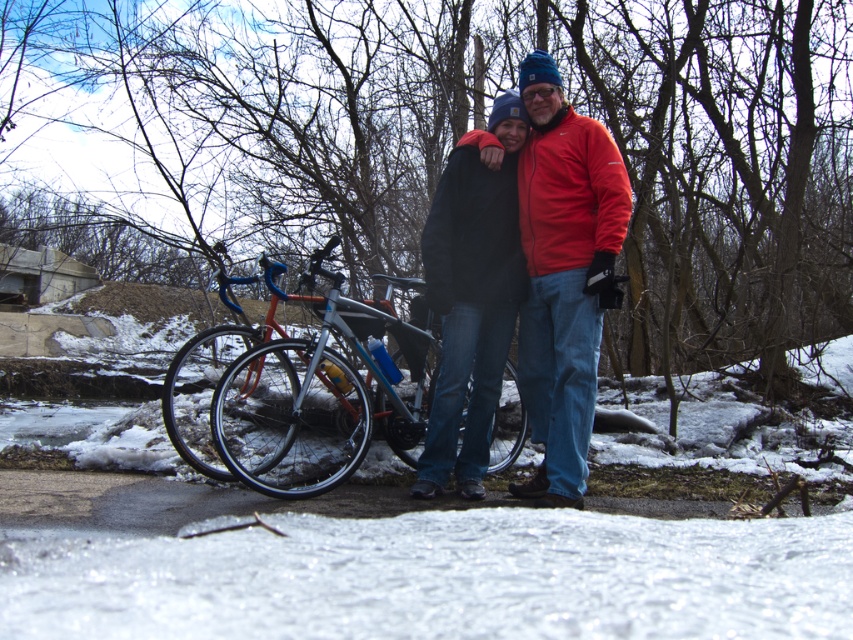
Question: Which point is farther to the camera?

Choices:
 (A) matte black jacket at center
 (B) black matte jacket at center

Answer: (B)

Question: Considering the real-world distances, which object is closest to the matte black jacket at center?

Choices:
 (A) shiny metallic bicycle at center
 (B) black matte jacket at center

Answer: (B)

Question: Observing the image, what is the correct spatial positioning of shiny metallic bicycle at center in reference to black matte jacket at center?

Choices:
 (A) below
 (B) above

Answer: (A)

Question: Can you confirm if shiny metallic bicycle at center is bigger than black matte jacket at center?

Choices:
 (A) no
 (B) yes

Answer: (B)

Question: Is matte black jacket at center to the right of black matte jacket at center from the viewer's perspective?

Choices:
 (A) no
 (B) yes

Answer: (B)

Question: Which object appears farthest from the camera in this image?

Choices:
 (A) shiny metallic bicycle at center
 (B) black matte jacket at center
 (C) matte black jacket at center

Answer: (B)